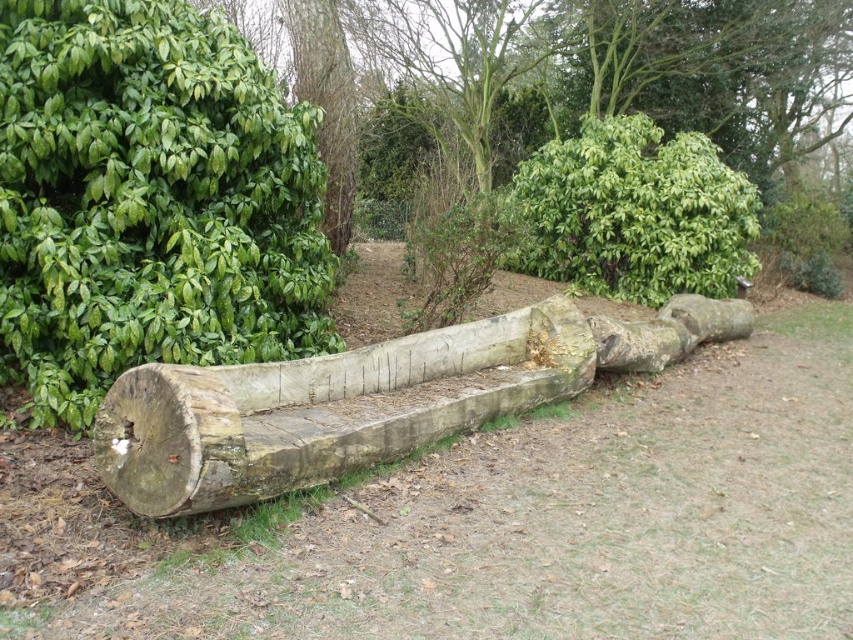
Between green leafy hedge at upper center and brown rough tree trunk at upper center, which one appears on the left side from the viewer's perspective?

Positioned to the left is brown rough tree trunk at upper center.

Which is more to the right, green leafy hedge at upper center or brown rough tree trunk at upper center?

green leafy hedge at upper center

This screenshot has height=640, width=853. Identify the location of green leafy hedge at upper center. (634, 212).

Where is `green leafy hedge at upper center`? green leafy hedge at upper center is located at coordinates (634, 212).

Does weathered wood bench at center have a greater width compared to green leafy hedge at upper center?

In fact, weathered wood bench at center might be narrower than green leafy hedge at upper center.

Between weathered wood bench at center and green leafy hedge at upper center, which one appears on the left side from the viewer's perspective?

weathered wood bench at center

Where is `weathered wood bench at center`? This screenshot has height=640, width=853. weathered wood bench at center is located at coordinates (367, 400).

Is weathered wood bench at center shorter than brown rough tree trunk at upper center?

Yes, weathered wood bench at center is shorter than brown rough tree trunk at upper center.

Who is positioned more to the left, weathered wood bench at center or brown rough tree trunk at upper center?

From the viewer's perspective, brown rough tree trunk at upper center appears more on the left side.

Does point (111, 464) come closer to viewer compared to point (344, 138)?

Yes, point (111, 464) is in front of point (344, 138).

Find the location of `weathered wood bench at center`. weathered wood bench at center is located at coordinates (367, 400).